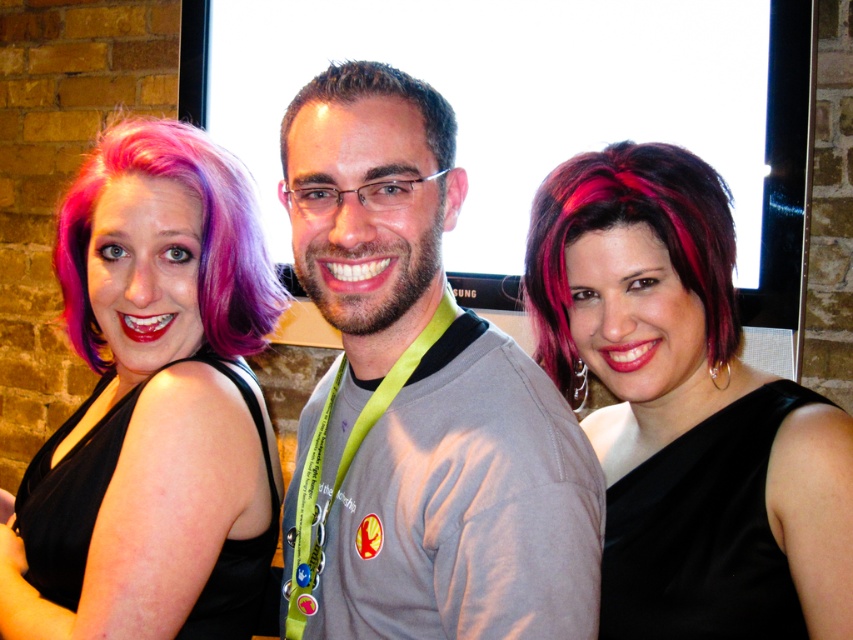
Question: Does gray fabric shirt at center have a larger size compared to matte purple wig at left?

Choices:
 (A) yes
 (B) no

Answer: (B)

Question: Which object appears farthest from the camera in this image?

Choices:
 (A) shiny dark red hair at center
 (B) brown matte hair at center
 (C) purplehair at left
 (D) gray fabric shirt at center

Answer: (C)

Question: Which object is closer to the camera taking this photo?

Choices:
 (A) shiny black dress at center
 (B) shiny dark red hair at center
 (C) matte purple wig at left
 (D) purplehair at left

Answer: (A)

Question: Is matte purple wig at left bigger than purplehair at left?

Choices:
 (A) no
 (B) yes

Answer: (B)

Question: Can you confirm if purplehair at left is positioned below brown matte hair at center?

Choices:
 (A) no
 (B) yes

Answer: (B)

Question: Among these points, which one is farthest from the camera?

Choices:
 (A) (572, 506)
 (B) (699, 244)
 (C) (619, 416)
 (D) (184, 244)

Answer: (C)